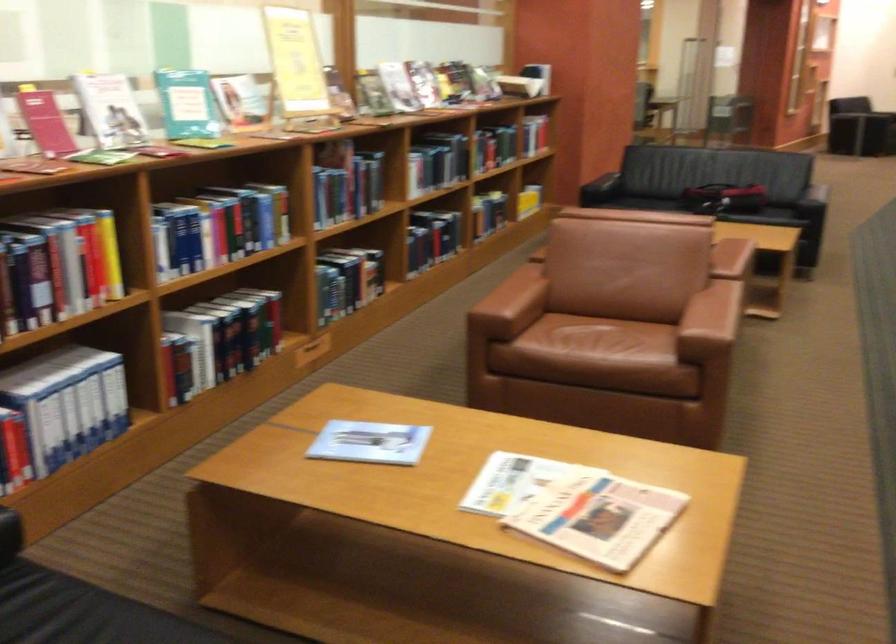
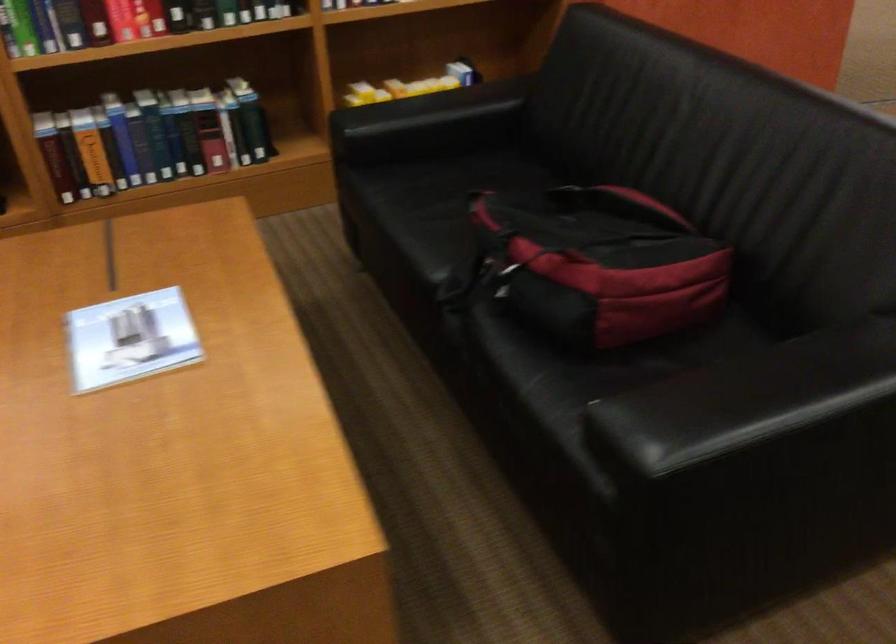
The point at (496,156) is marked in the first image. Where is the corresponding point in the second image?

(123, 21)